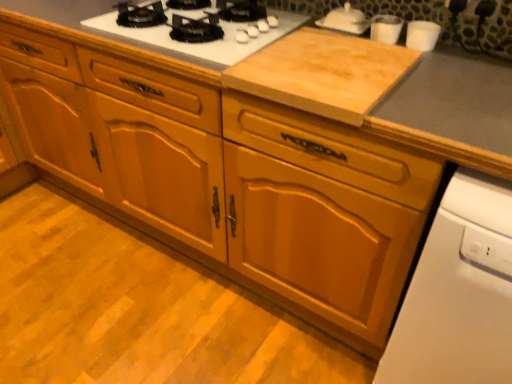
Question: From the image's perspective, is white glossy cups at upper right, the first appliance in the right-to-left sequence, positioned above or below white glossy dishwasher at lower right?

Choices:
 (A) above
 (B) below

Answer: (A)

Question: Is white glossy cups at upper right, the first appliance in the right-to-left sequence, bigger or smaller than white glossy dishwasher at lower right?

Choices:
 (A) small
 (B) big

Answer: (A)

Question: Estimate the real-world distances between objects in this image. Which object is farther from the white glossy teapot at upper right, arranged as the third appliance when viewed from the right?

Choices:
 (A) white glossy cups at upper right, the first appliance in the right-to-left sequence
 (B) clear glass cups at upper right, the 2th appliance viewed from the right
 (C) white glossy gas stove at upper center
 (D) white glossy dishwasher at lower right
 (E) natural wood cutting board at center

Answer: (D)

Question: Estimate the real-world distances between objects in this image. Which object is farther from the white glossy teapot at upper right, which is the 1th appliance in left-to-right order?

Choices:
 (A) clear glass cups at upper right, arranged as the 2th appliance when viewed from the left
 (B) white glossy cups at upper right, the first appliance in the right-to-left sequence
 (C) white glossy gas stove at upper center
 (D) white glossy dishwasher at lower right
 (E) natural wood cutting board at center

Answer: (D)